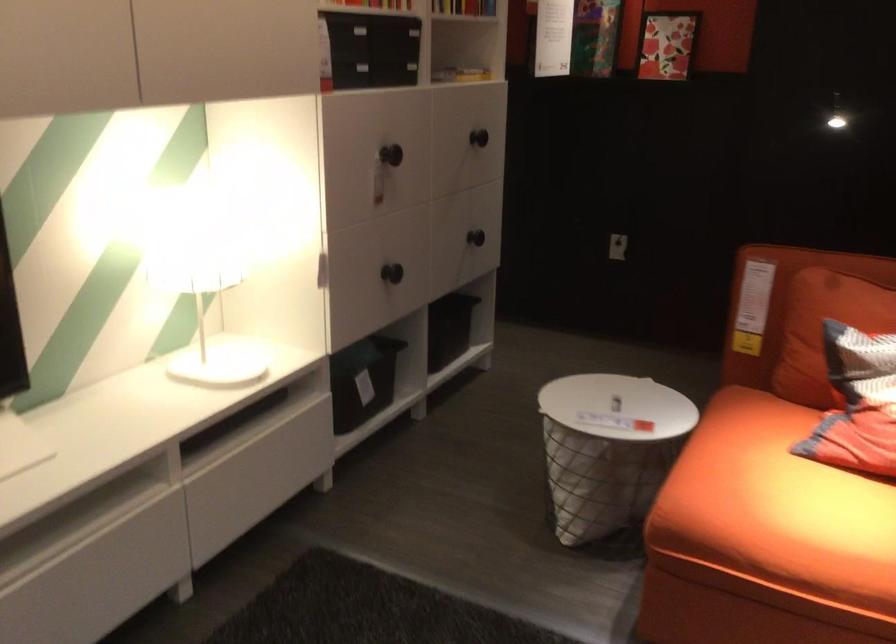
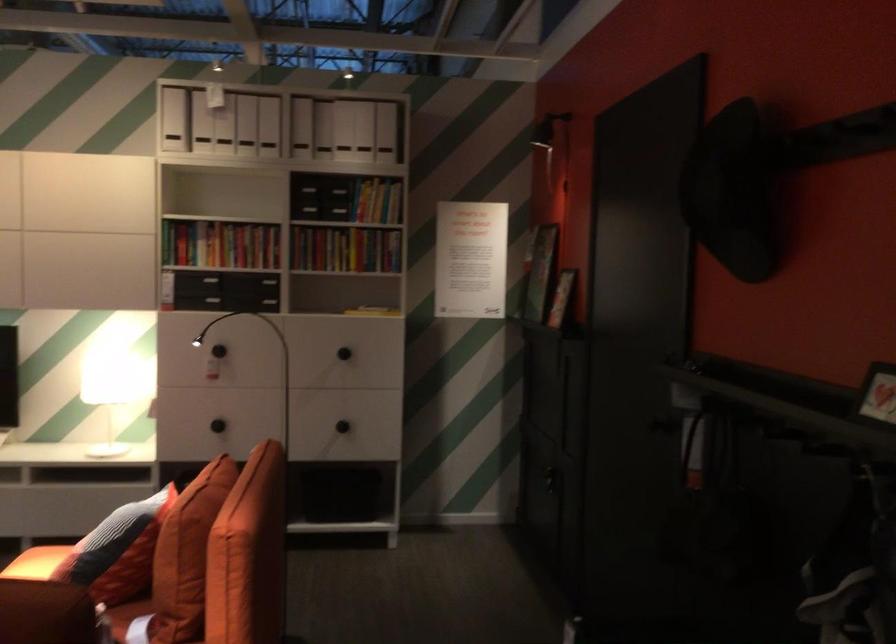
Find the pixel in the second image that matches pixel 313 252 in the first image.

(108, 391)